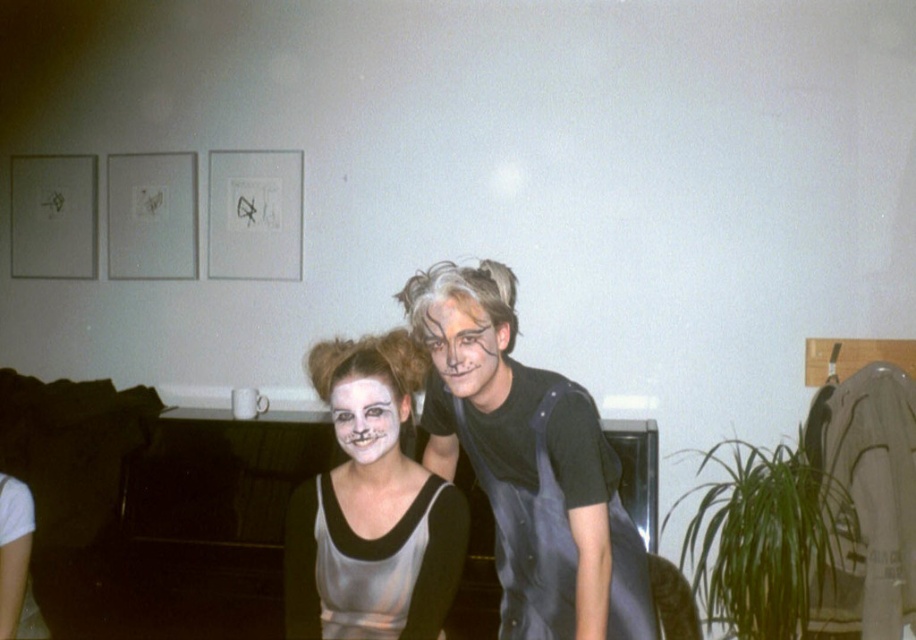
Based on the photo, you are planning to take a photo of the two people in the scene. The matte silver dress at center and the matte black face at center are both in the frame. Which object would appear larger in the photo?

The matte silver dress at center would appear larger in the photo because it is bigger than the matte black face at center.

You are a photographer trying to capture the perfect shot of the satin silver dress at center. Based on the coordinates provided, where should you position your camera to ensure the dress is centered in your frame?

The satin silver dress at center is located at coordinates point (388, 564). To center it in your frame, position your camera so that the dress aligns with the center point of your viewfinder.